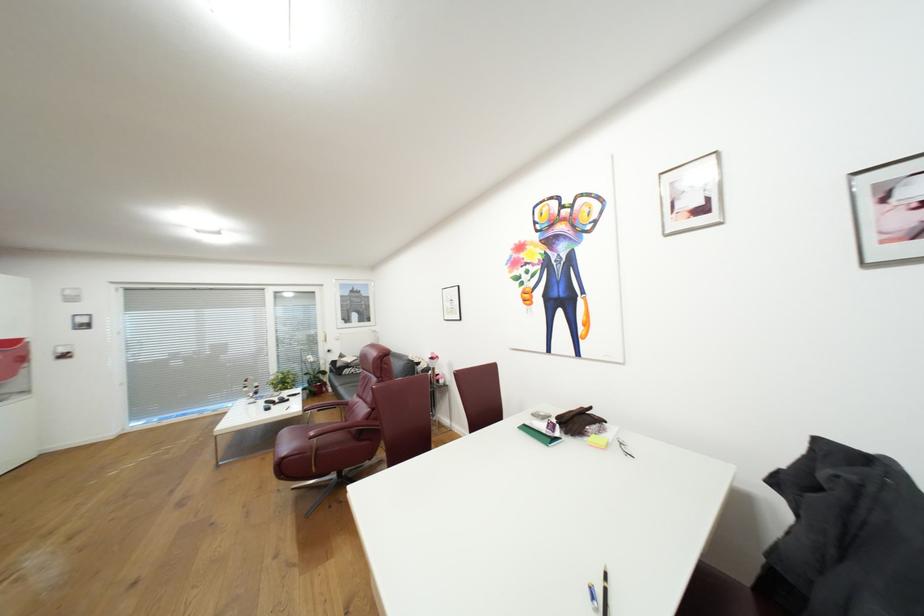
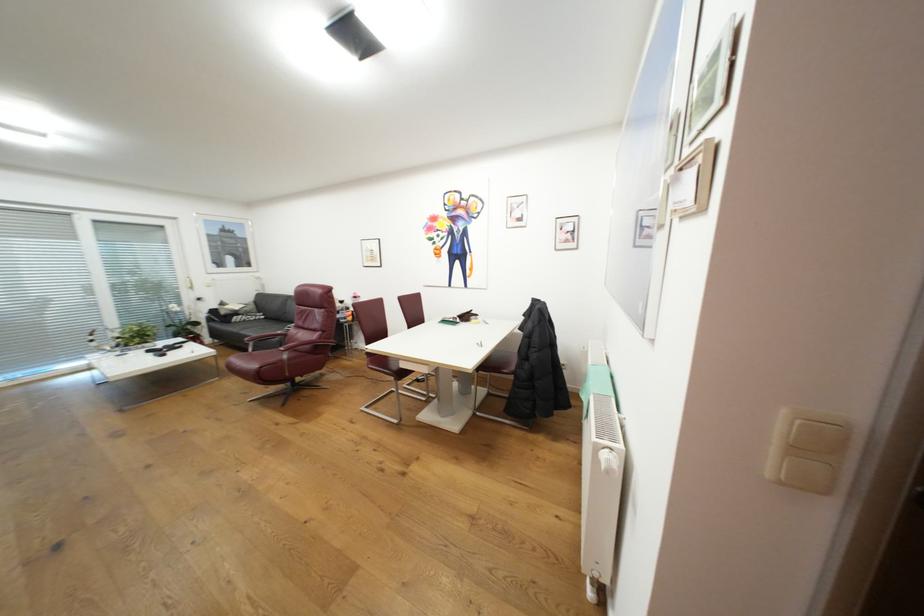
In the second image, find the point that corresponds to [354,371] in the first image.

(244, 318)